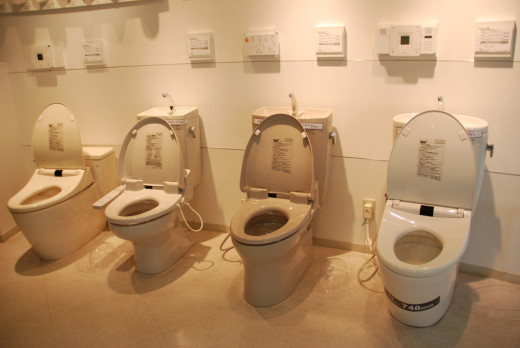
I want to click on white toilets, so click(454, 233), click(151, 214), click(66, 186).